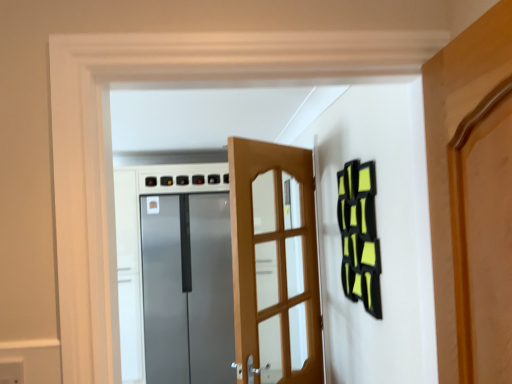
Question: Considering their positions, is wooden door at center, positioned as the first door in right-to-left order, located in front of or behind matte gray electric outlet at lower left?

Choices:
 (A) behind
 (B) front

Answer: (A)

Question: From their relative heights in the image, would you say wooden door at center, positioned as the first door in right-to-left order, is taller or shorter than matte gray electric outlet at lower left?

Choices:
 (A) tall
 (B) short

Answer: (A)

Question: Which object is positioned closest to the matte gray electric outlet at lower left?

Choices:
 (A) wooden door at center, acting as the first door starting from the front
 (B) satin metallic refrigerator at center, acting as the 2th door starting from the right

Answer: (A)

Question: Which is nearer to the satin metallic refrigerator at center, placed as the first door when sorted from left to right?

Choices:
 (A) matte gray electric outlet at lower left
 (B) wooden door at center, the second door from the left

Answer: (B)